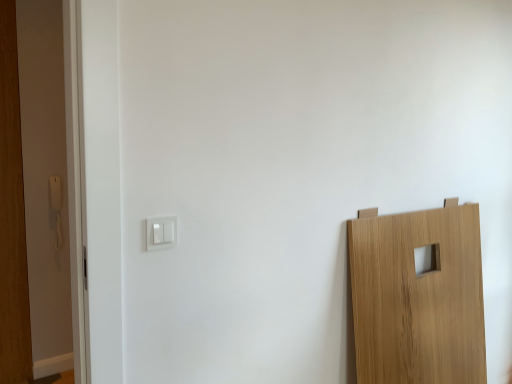
Question: Looking at their shapes, would you say white plastic light switch at upper left, positioned as the first light switch in front-to-back order, is wider or thinner than white plastic light switch at center-left, which is the first light switch from back to front?

Choices:
 (A) wide
 (B) thin

Answer: (B)

Question: Is white plastic light switch at upper left, the 1th light switch when ordered from bottom to top, taller or shorter than white plastic light switch at center-left, which is the first light switch from back to front?

Choices:
 (A) short
 (B) tall

Answer: (A)

Question: From the image's perspective, is white plastic light switch at upper left, which is counted as the 2th light switch, starting from the top, positioned above or below white plastic light switch at center-left, the 2th light switch when ordered from front to back?

Choices:
 (A) below
 (B) above

Answer: (A)

Question: Is white plastic light switch at center-left, marked as the first light switch in a top-to-bottom arrangement, to the left or to the right of white plastic light switch at upper left, which is counted as the 2th light switch, starting from the top, in the image?

Choices:
 (A) left
 (B) right

Answer: (A)

Question: From the image's perspective, relative to white plastic light switch at upper left, which ranks as the 2th light switch in back-to-front order, is white plastic light switch at center-left, which is the first light switch in left-to-right order, above or below?

Choices:
 (A) below
 (B) above

Answer: (B)

Question: Do you think white plastic light switch at center-left, acting as the 2th light switch starting from the right, is within white plastic light switch at upper left, positioned as the first light switch in front-to-back order, or outside of it?

Choices:
 (A) outside
 (B) inside

Answer: (A)

Question: Looking at the image, does white plastic light switch at center-left, the 2th light switch when ordered from front to back, seem bigger or smaller compared to white plastic light switch at upper left, which is counted as the 2th light switch, starting from the top?

Choices:
 (A) big
 (B) small

Answer: (A)